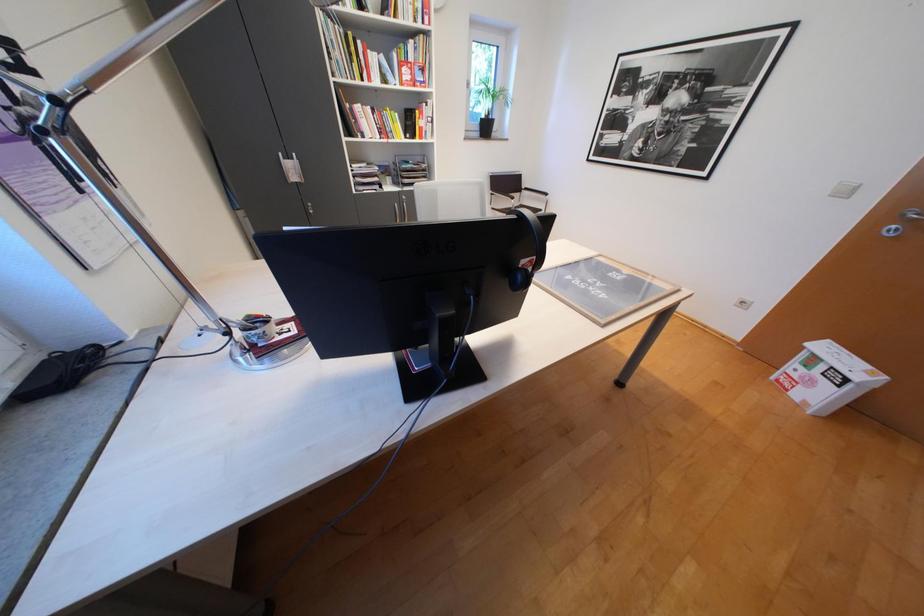
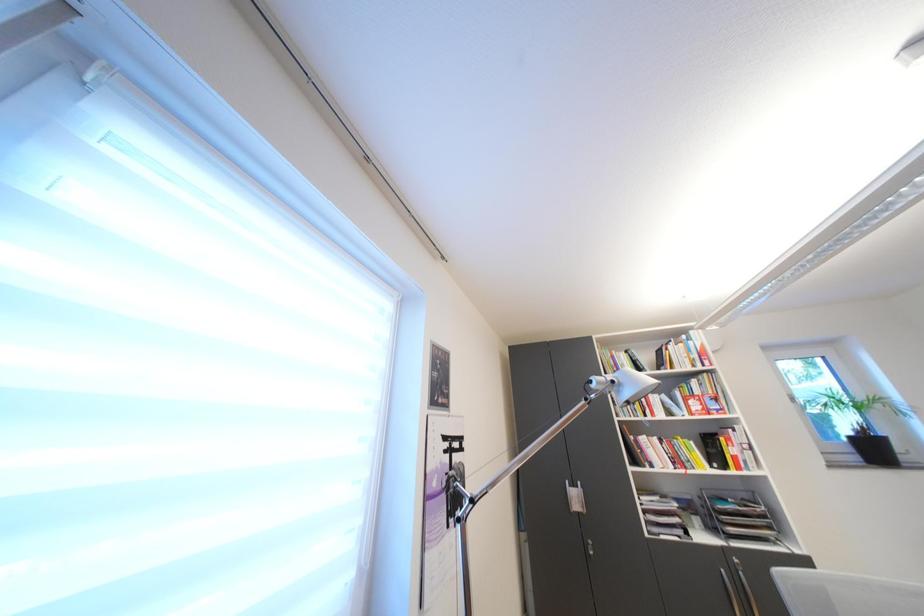
The first image is from the beginning of the video and the second image is from the end. How did the camera likely rotate when shooting the video?

The rotation direction of the camera is left-up.